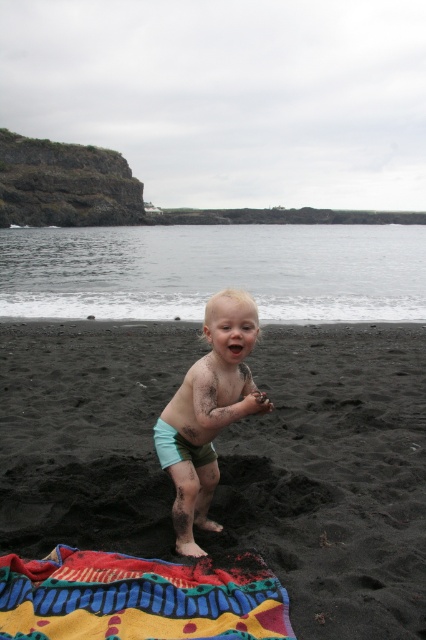
Looking at this image, who is positioned more to the left, black sand at center or multicolored woven towel at lower left?

multicolored woven towel at lower left

The width and height of the screenshot is (426, 640). In order to click on black sand at center in this screenshot , I will do `click(333, 477)`.

Does dirty teal shorts at center have a greater width compared to light blue fabric diaper at center?

Indeed, dirty teal shorts at center has a greater width compared to light blue fabric diaper at center.

Between point (164, 444) and point (164, 444), which one is positioned behind?

Point (164, 444)

Is point (192, 371) in front of point (183, 448)?

Yes, point (192, 371) is in front of point (183, 448).

This screenshot has width=426, height=640. Find the location of `dirty teal shorts at center`. dirty teal shorts at center is located at coordinates (207, 412).

Who is shorter, multicolored woven towel at lower left or light blue fabric diaper at center?

multicolored woven towel at lower left

Is point (227, 584) more distant than point (189, 456)?

No, it is not.

At what (x,y) coordinates should I click in order to perform the action: click on multicolored woven towel at lower left. Please return your answer as a coordinate pair (x, y). Looking at the image, I should click on (140, 596).